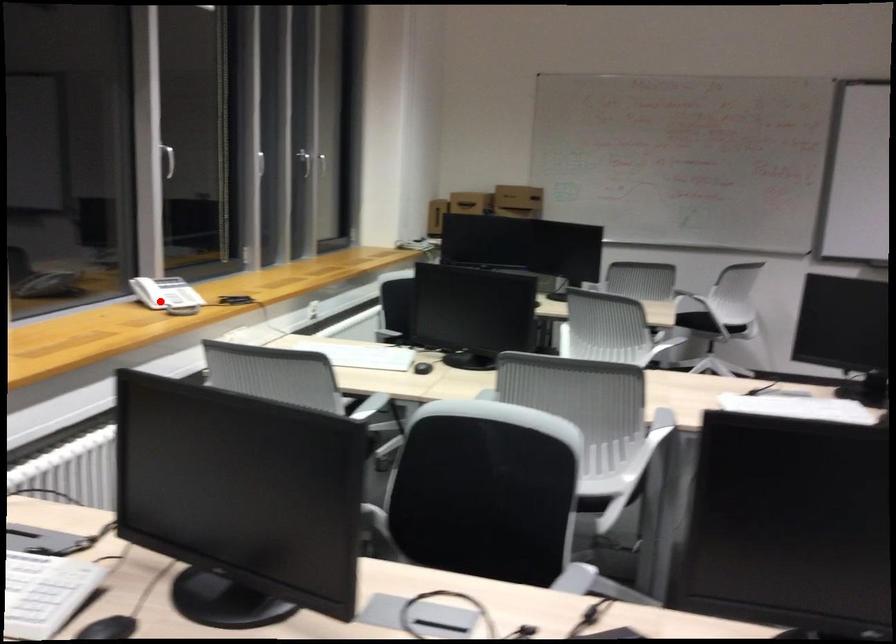
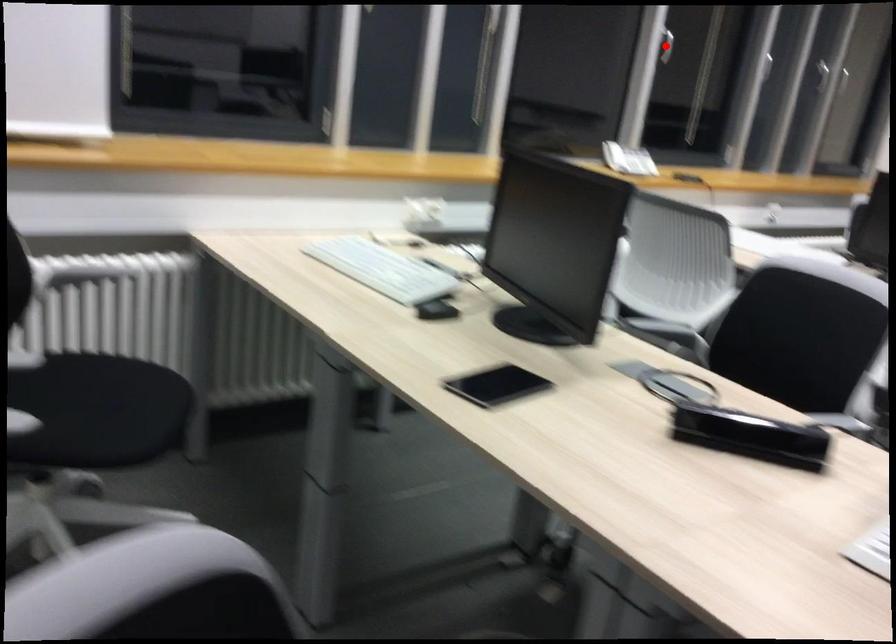
I am providing you with two images of the same scene from different viewpoints. A red point is marked on the first image and another point is marked on the second image. Is the marked point in image1 the same physical position as the marked point in image2?

No